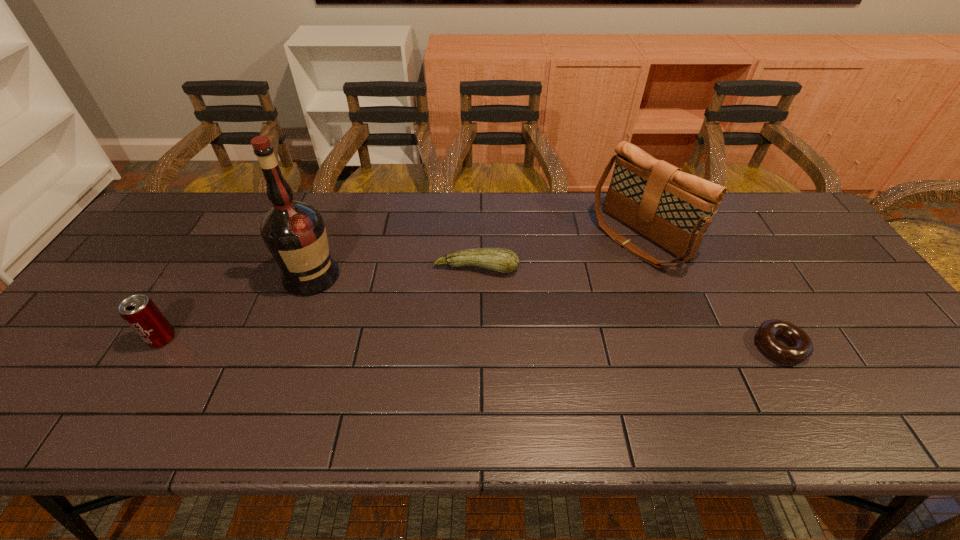
Where is `vacant space on the desktop that is between the third shortest object and the doughnut and is positioned on the surface of the liquor`? This screenshot has width=960, height=540. vacant space on the desktop that is between the third shortest object and the doughnut and is positioned on the surface of the liquor is located at coordinates (382, 341).

Find the location of `free spot on the desktop that is between the beer can and the rightmost object and is positioned at the stem end of the fourth tallest object`. free spot on the desktop that is between the beer can and the rightmost object and is positioned at the stem end of the fourth tallest object is located at coordinates (462, 342).

This screenshot has width=960, height=540. I want to click on vacant space on the desktop that is between the third shortest object and the shortest object and is positioned on the front-facing side of the fourth shortest object, so click(x=476, y=343).